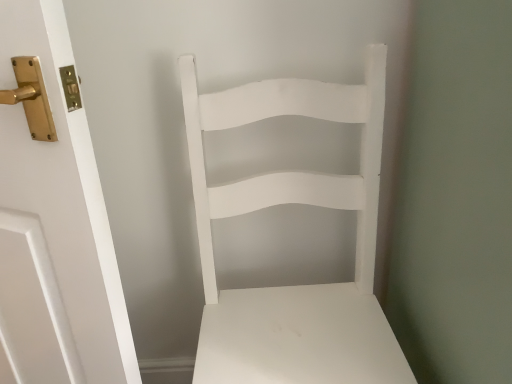
Measure the distance between point (336, 292) and camera.

A distance of 39.17 inches exists between point (336, 292) and camera.

Image resolution: width=512 pixels, height=384 pixels. Identify the location of white matte chair at center. (293, 203).

What do you see at coordinates (293, 203) in the screenshot? I see `white matte chair at center` at bounding box center [293, 203].

The image size is (512, 384). What are the coordinates of `white matte chair at center` in the screenshot? It's located at pyautogui.click(x=293, y=203).